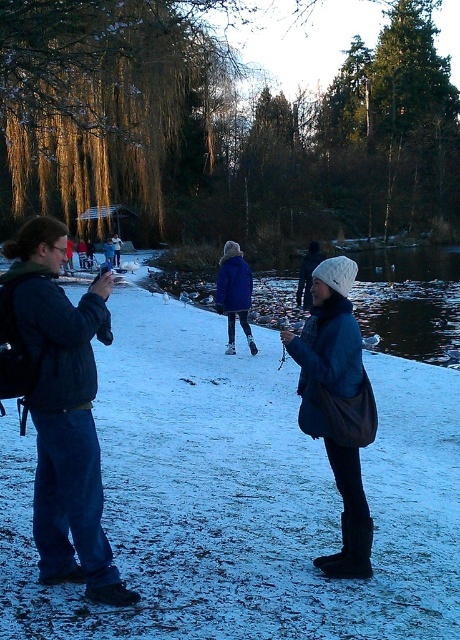
From the picture: Is matte blue coat at center below blue woolen coat at center?

Correct, matte blue coat at center is located below blue woolen coat at center.

Is point (303, 401) farther from camera compared to point (237, 273)?

No, (303, 401) is closer to viewer.

This screenshot has width=460, height=640. I want to click on matte blue coat at center, so click(x=338, y=406).

Between glossy blue lake at center and matte blue coat at center, which one appears on the right side from the viewer's perspective?

From the viewer's perspective, glossy blue lake at center appears more on the right side.

Can you confirm if glossy blue lake at center is thinner than matte blue coat at center?

No, glossy blue lake at center is not thinner than matte blue coat at center.

Is point (372, 316) positioned behind point (350, 513)?

Yes, point (372, 316) is farther from viewer.

Identify the location of glossy blue lake at center. (409, 301).

Between dark blue denim jacket at left and blue woolen coat at center, which one has less height?

blue woolen coat at center

Looking at this image, does dark blue denim jacket at left have a greater height compared to blue woolen coat at center?

Yes.

The width and height of the screenshot is (460, 640). Describe the element at coordinates (58, 404) in the screenshot. I see `dark blue denim jacket at left` at that location.

Where is `dark blue denim jacket at left`? This screenshot has height=640, width=460. dark blue denim jacket at left is located at coordinates (58, 404).